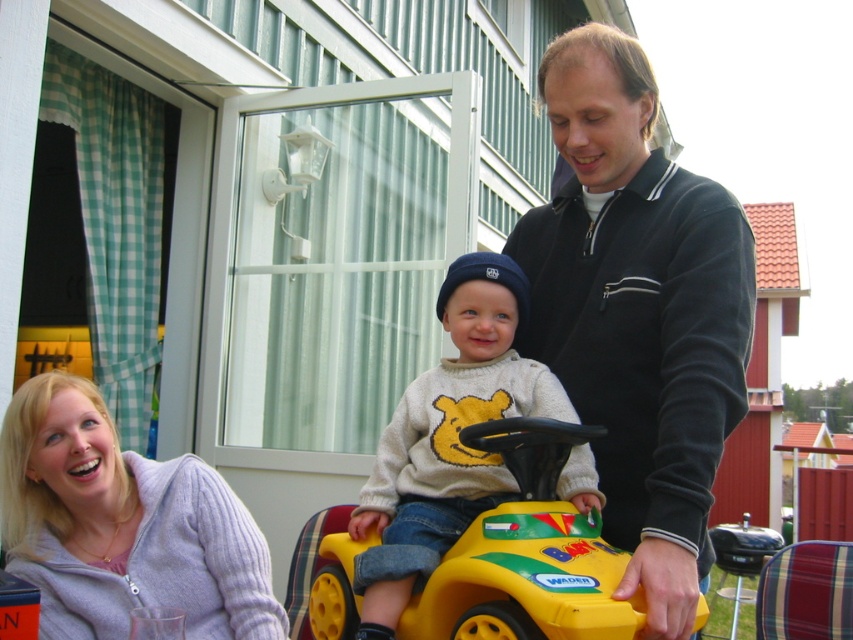
Question: Where is light gray sweater at center located in relation to yellow plastic toy car at center in the image?

Choices:
 (A) right
 (B) left

Answer: (A)

Question: Which object appears farthest from the camera in this image?

Choices:
 (A) light gray sweater at center
 (B) yellow plastic toy car at center
 (C) black fleece at center

Answer: (A)

Question: Estimate the real-world distances between objects in this image. Which object is farther from the light gray sweater at center?

Choices:
 (A) light purple knit sweater at lower left
 (B) black fleece at center

Answer: (A)

Question: Observing the image, what is the correct spatial positioning of light purple knit sweater at lower left in reference to yellow plastic toy car at center?

Choices:
 (A) below
 (B) above

Answer: (A)

Question: Observing the image, what is the correct spatial positioning of light gray sweater at center in reference to yellow plastic toy car at center?

Choices:
 (A) left
 (B) right

Answer: (B)

Question: Considering the real-world distances, which object is farthest from the yellow plastic toy car at center?

Choices:
 (A) light gray sweater at center
 (B) light purple knit sweater at lower left
 (C) black fleece at center

Answer: (B)